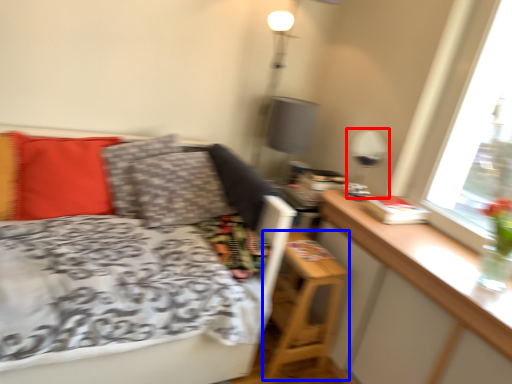
Question: Among these objects, which one is nearest to the camera, table lamp (highlighted by a red box) or nightstand (highlighted by a blue box)?

Choices:
 (A) table lamp
 (B) nightstand

Answer: (B)